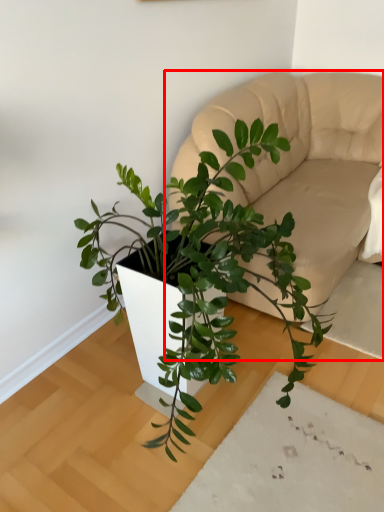
Question: In this image, where is couch (annotated by the red box) located relative to houseplant?

Choices:
 (A) left
 (B) right

Answer: (B)